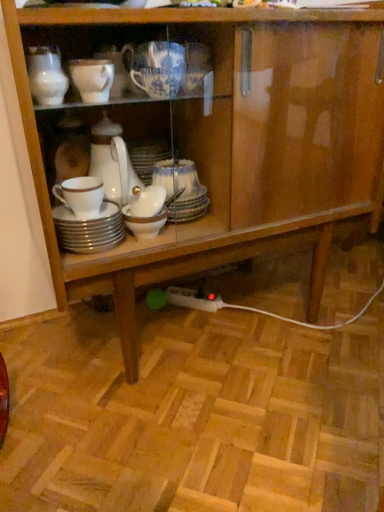
Question: Is white glossy plates at center, which is the 2th tableware in right-to-left order, further to camera compared to blue and white porcelain cup at upper center, placed as the 2th tableware when sorted from left to right?

Choices:
 (A) yes
 (B) no

Answer: (A)

Question: Is white glossy plates at center, which ranks as the first tableware in bottom-to-top order, wider than blue and white porcelain cup at upper center, acting as the 1th tableware starting from the top?

Choices:
 (A) no
 (B) yes

Answer: (B)

Question: Does white glossy plates at center, which ranks as the first tableware in bottom-to-top order, appear on the right side of blue and white porcelain cup at upper center, which ranks as the 1th tableware in right-to-left order?

Choices:
 (A) no
 (B) yes

Answer: (A)

Question: From a real-world perspective, is white glossy plates at center, the 2th tableware in the top-to-bottom sequence, beneath blue and white porcelain cup at upper center, the second tableware in the bottom-to-top sequence?

Choices:
 (A) yes
 (B) no

Answer: (A)

Question: From a real-world perspective, is white glossy plates at center, which is the 2th tableware in right-to-left order, physically above blue and white porcelain cup at upper center, placed as the 2th tableware when sorted from left to right?

Choices:
 (A) yes
 (B) no

Answer: (B)

Question: Is white glossy plates at center, which is the 2th tableware in right-to-left order, far from blue and white porcelain cup at upper center, which ranks as the 1th tableware in right-to-left order?

Choices:
 (A) yes
 (B) no

Answer: (B)

Question: Does blue and white porcelain cup at upper center, the second tableware in the bottom-to-top sequence, have a greater height compared to white glossy plates at center, the 2th tableware in the top-to-bottom sequence?

Choices:
 (A) yes
 (B) no

Answer: (A)

Question: Is blue and white porcelain cup at upper center, which ranks as the 1th tableware in right-to-left order, to the right of white glossy plates at center, which is the 2th tableware in right-to-left order, from the viewer's perspective?

Choices:
 (A) yes
 (B) no

Answer: (A)

Question: Is blue and white porcelain cup at upper center, which ranks as the 1th tableware in right-to-left order, smaller than white glossy plates at center, which ranks as the first tableware in bottom-to-top order?

Choices:
 (A) yes
 (B) no

Answer: (B)

Question: Is blue and white porcelain cup at upper center, acting as the 1th tableware starting from the top, positioned in front of white glossy plates at center, which is counted as the 1th tableware, starting from the left?

Choices:
 (A) no
 (B) yes

Answer: (B)

Question: From a real-world perspective, does blue and white porcelain cup at upper center, the second tableware in the bottom-to-top sequence, sit lower than white glossy plates at center, the 2th tableware in the top-to-bottom sequence?

Choices:
 (A) yes
 (B) no

Answer: (B)

Question: Is blue and white porcelain cup at upper center, placed as the 2th tableware when sorted from left to right, beside white glossy plates at center, which is counted as the 1th tableware, starting from the left?

Choices:
 (A) yes
 (B) no

Answer: (B)

Question: Considering the positions of white glossy plates at center, which ranks as the first tableware in bottom-to-top order, and blue and white porcelain cup at upper center, the second tableware in the bottom-to-top sequence, in the image, is white glossy plates at center, which ranks as the first tableware in bottom-to-top order, bigger or smaller than blue and white porcelain cup at upper center, the second tableware in the bottom-to-top sequence,?

Choices:
 (A) big
 (B) small

Answer: (B)